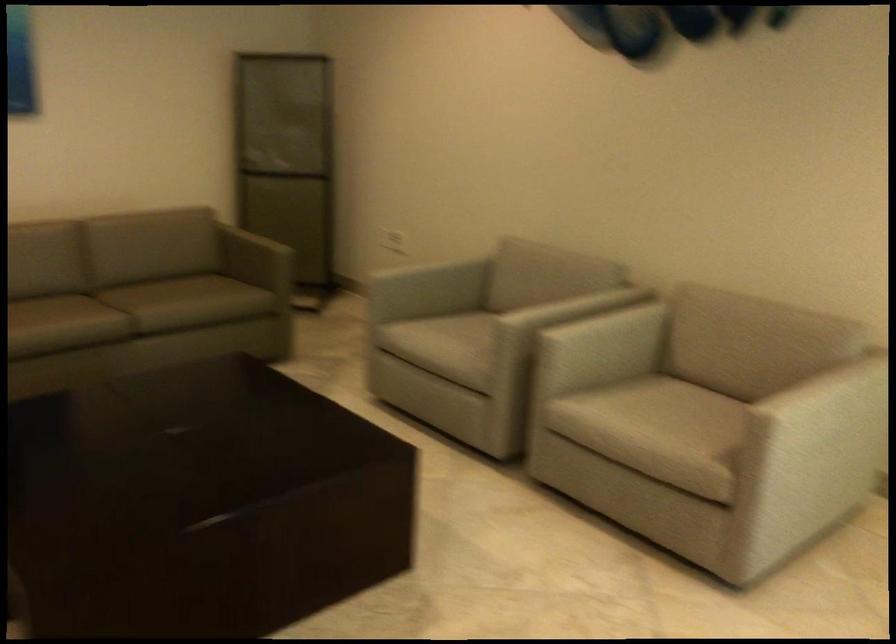
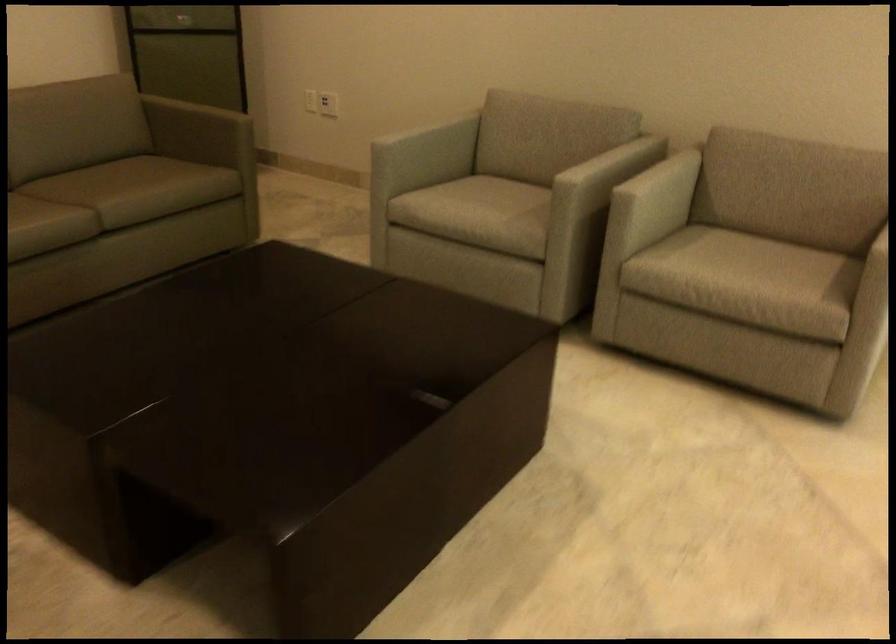
In the second image, find the point that corresponds to the point at 386,240 in the first image.

(328, 104)